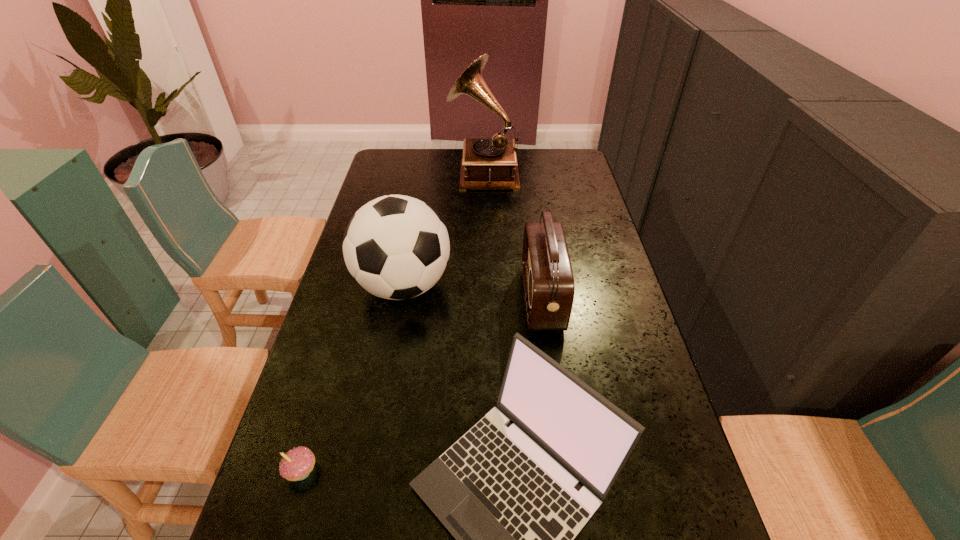
Locate an element on the screen. This screenshot has height=540, width=960. the farthest object is located at coordinates (492, 163).

Find the location of a particular element. This screenshot has height=540, width=960. record player is located at coordinates (492, 163).

The image size is (960, 540). Identify the location of soccer ball. [396, 247].

I want to click on radio receiver, so click(548, 281).

At what (x,y) coordinates should I click in order to perform the action: click on the shortest object. Please return your answer as a coordinate pair (x, y). The height and width of the screenshot is (540, 960). Looking at the image, I should click on (296, 465).

I want to click on vacant space located 0.210m on the horn of the tallest object, so click(398, 172).

Locate an element on the screen. This screenshot has height=540, width=960. vacant region located 0.220m on the horn of the tallest object is located at coordinates pyautogui.click(x=396, y=172).

You are a GUI agent. You are given a task and a screenshot of the screen. Output one action in this format:
    pyautogui.click(x=<x>, y=<y>)
    Task: Click on the blank area located 0.260m on the horn of the tallest object
    This screenshot has height=540, width=960.
    Given the screenshot: What is the action you would take?
    pyautogui.click(x=386, y=172)

Locate an element on the screen. This screenshot has height=540, width=960. free space located on the right of the soccer ball is located at coordinates (533, 285).

This screenshot has height=540, width=960. I want to click on free space located 0.370m on the front panel of the radio receiver, so tap(395, 299).